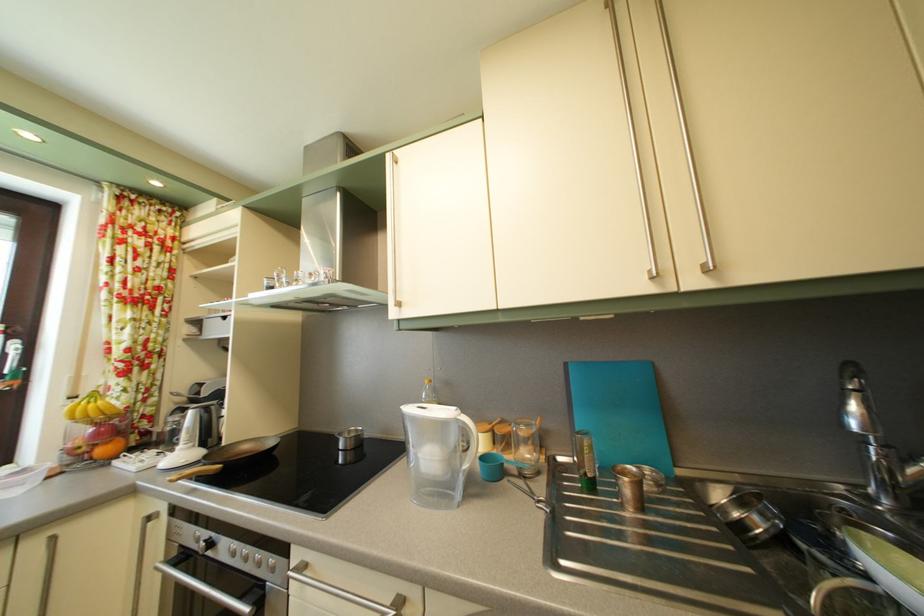
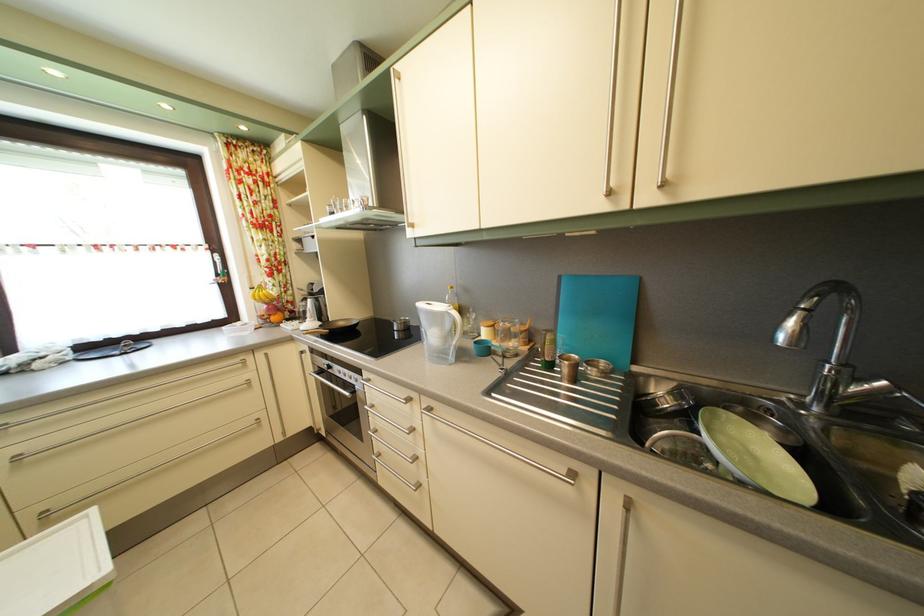
Where in the second image is the point corresponding to point 160,460 from the first image?

(305, 330)